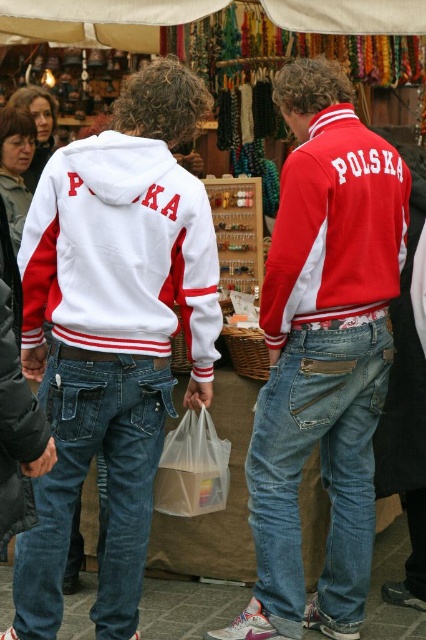
Find the location of `matte red jacket at center`. matte red jacket at center is located at coordinates (322, 353).

Is point (281, 637) positioned before point (109, 424)?

Yes, it is.

Is point (342, 152) positioned behind point (111, 474)?

That is False.

Where is `matte red jacket at center`? This screenshot has width=426, height=640. matte red jacket at center is located at coordinates (322, 353).

Between matte red jacket at center and white matte jacket at center, which one appears on the left side from the viewer's perspective?

Positioned to the left is white matte jacket at center.

Can you confirm if matte red jacket at center is positioned to the right of white matte jacket at center?

Correct, you'll find matte red jacket at center to the right of white matte jacket at center.

Describe the element at coordinates (322, 353) in the screenshot. The image size is (426, 640). I see `matte red jacket at center` at that location.

Locate an element on the screen. The image size is (426, 640). matte red jacket at center is located at coordinates (322, 353).

Is denim at center thinner than red matte jacket at center?

Yes.

Is point (288, 621) positioned behind point (319, 220)?

Yes, point (288, 621) is farther from viewer.

Is point (351, 349) positioned behind point (331, 141)?

Yes, it is.

This screenshot has height=640, width=426. I want to click on denim at center, so click(x=321, y=467).